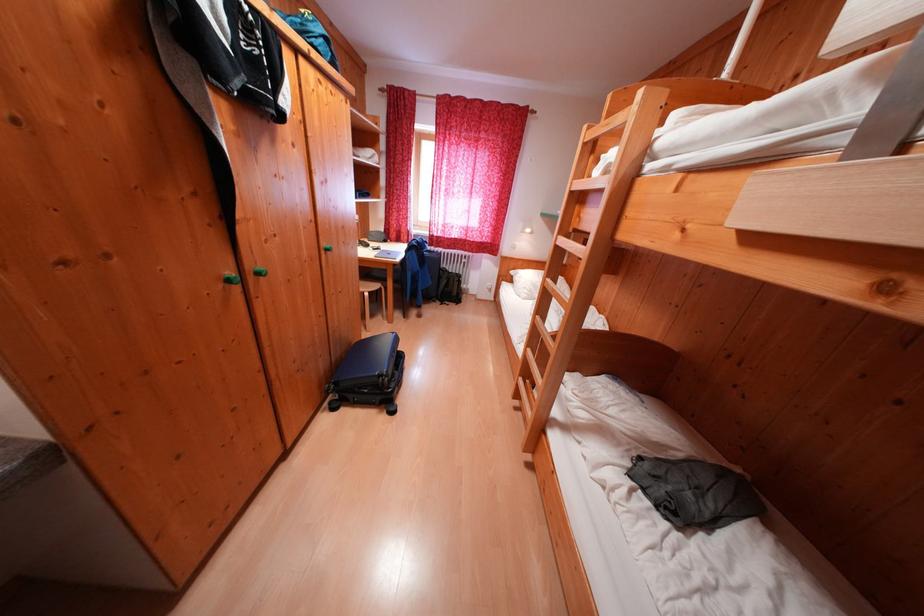
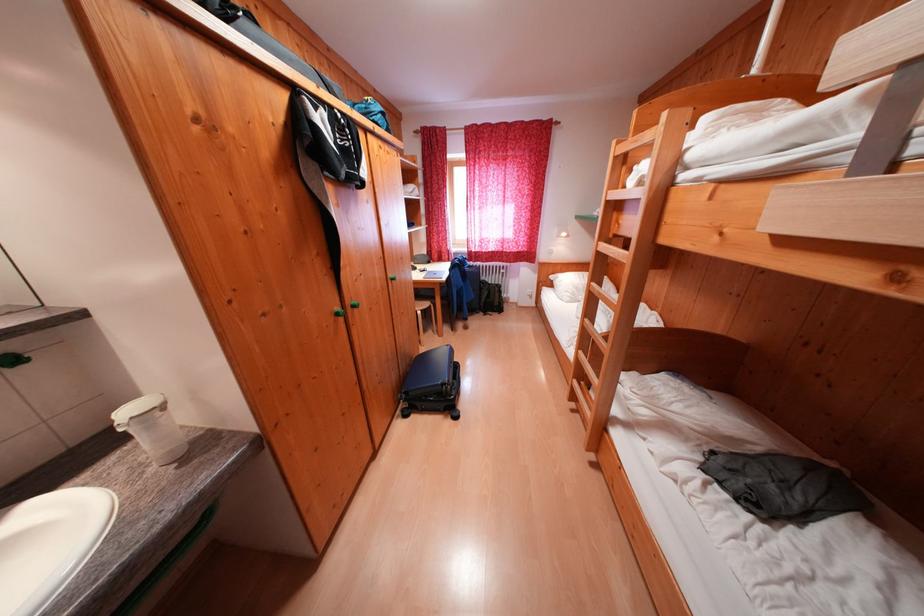
The point at (416, 256) is marked in the first image. Where is the corresponding point in the second image?

(458, 274)